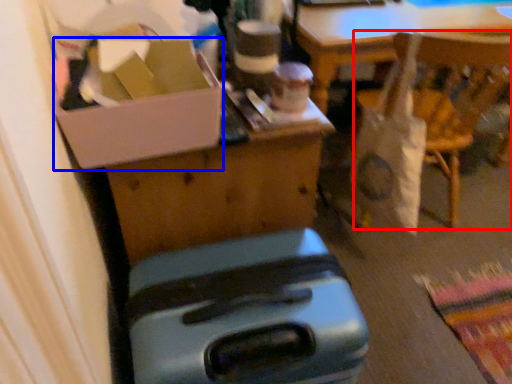
Question: Which object is closer to the camera taking this photo, chair (highlighted by a red box) or box (highlighted by a blue box)?

Choices:
 (A) chair
 (B) box

Answer: (B)